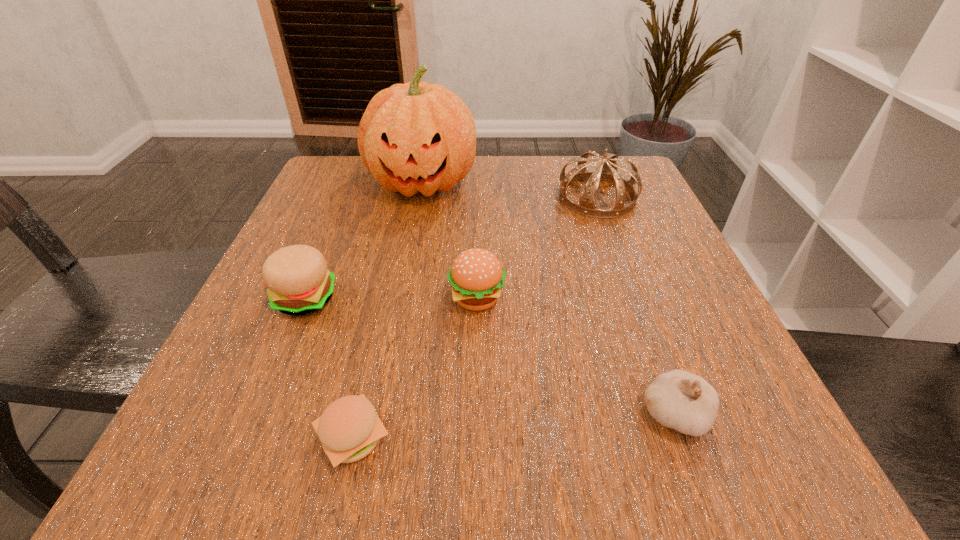
You are a GUI agent. You are given a task and a screenshot of the screen. Output one action in this format:
    pyautogui.click(x=<x>, y=<y>)
    Task: Click on the free space between the rightmost hamburger and the leftmost hamburger
    Image resolution: width=960 pixels, height=540 pixels.
    Given the screenshot: What is the action you would take?
    pyautogui.click(x=391, y=299)

Select which object appears as the third closest to the shortest object. Please provide its 2D coordinates. Your answer should be formatted as a tuple, i.e. [(x, y)], where the tuple contains the x and y coordinates of a point satisfying the conditions above.

[(677, 399)]

At what (x,y) coordinates should I click in order to perform the action: click on object identified as the second closest to the nearest hamburger. Please return your answer as a coordinate pair (x, y). The image size is (960, 540). Looking at the image, I should click on (476, 276).

The width and height of the screenshot is (960, 540). In order to click on the second closest hamburger to the tallest object in this screenshot , I will do `click(476, 276)`.

Locate an element on the screen. hamburger that is the closest to the leftmost hamburger is located at coordinates (349, 429).

Where is `free space that satisfies the following two spatial constraints: 1. on the carved face of the rightmost hamburger; 2. on the right side of the pumpkin`? free space that satisfies the following two spatial constraints: 1. on the carved face of the rightmost hamburger; 2. on the right side of the pumpkin is located at coordinates (401, 299).

You are a GUI agent. You are given a task and a screenshot of the screen. Output one action in this format:
    pyautogui.click(x=<x>, y=<y>)
    Task: Click on the free spot that satisfies the following two spatial constraints: 1. on the front side of the leftmost hamburger; 2. on the right side of the second hamburger from right to left
    The height and width of the screenshot is (540, 960).
    Given the screenshot: What is the action you would take?
    (247, 438)

Image resolution: width=960 pixels, height=540 pixels. I want to click on free spot that satisfies the following two spatial constraints: 1. on the front side of the leftmost hamburger; 2. on the left side of the shortest object, so click(247, 438).

Where is `blank area in the image that satisfies the following two spatial constraints: 1. on the carved face of the fifth shortest object; 2. on the left side of the tallest object`? Image resolution: width=960 pixels, height=540 pixels. blank area in the image that satisfies the following two spatial constraints: 1. on the carved face of the fifth shortest object; 2. on the left side of the tallest object is located at coordinates (420, 198).